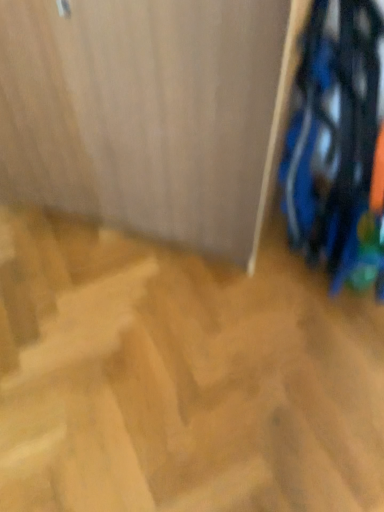
Question: Should I look upward or downward to see blue fabric laundry at right?

Choices:
 (A) up
 (B) down

Answer: (A)